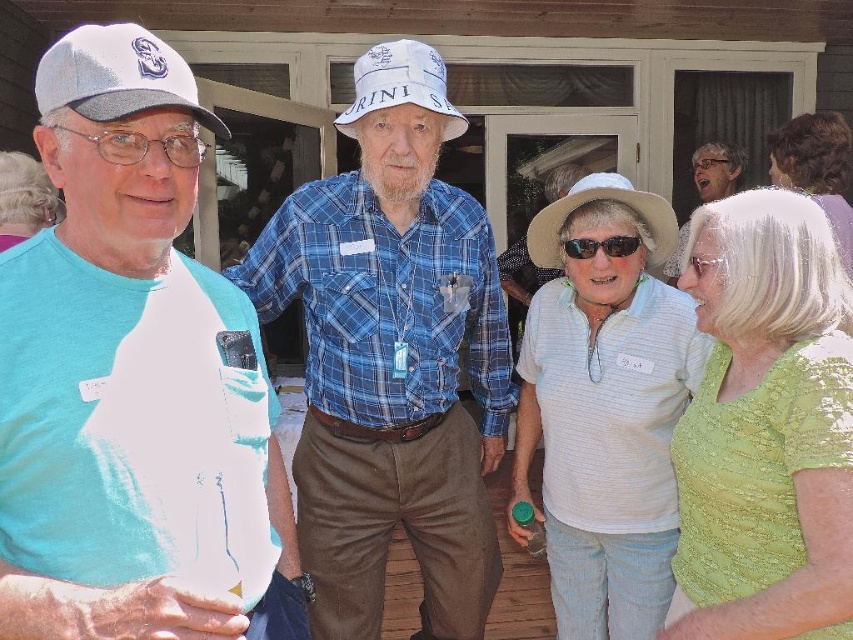
You are a photographer trying to capture a candid shot of the light brown curly hair at upper right and the clear plastic glasses at left. Which object is located higher in the image?

The light brown curly hair at upper right is positioned over clear plastic glasses at left, so it is higher in the image.

You are at an outdoor event and see two hats. The first is a matte white cap at left and the second is a white cotton baseball hat at center. Which hat is positioned more to the left?

The matte white cap at left is positioned more to the left than the white cotton baseball hat at center.